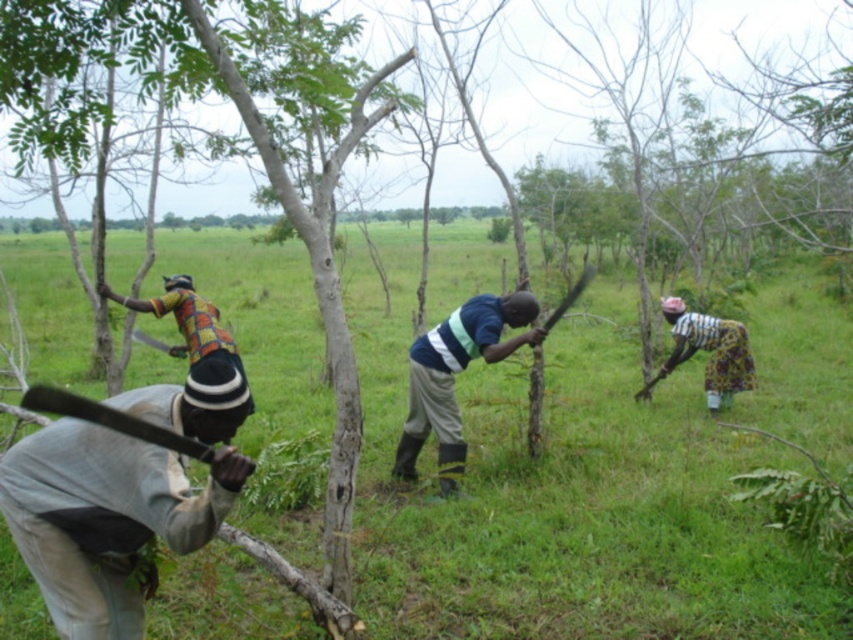
Looking at this image, does brown wooden stick at center have a greater width compared to multicolored fabric shirt at left?

Yes, brown wooden stick at center is wider than multicolored fabric shirt at left.

Is point (844, 632) positioned in front of point (148, 305)?

That is True.

Is point (572, 332) more distant than point (193, 337)?

Yes, it is behind point (193, 337).

Locate an element on the screen. The width and height of the screenshot is (853, 640). brown wooden stick at center is located at coordinates (572, 502).

Who is more distant from viewer, [158,492] or [51,403]?

Positioned behind is point [158,492].

Who is higher up, gray matte baseball bat at lower left or black matte ax at lower left?

black matte ax at lower left is above.

Is point (20, 460) more distant than point (83, 403)?

Yes.

Locate an element on the screen. The image size is (853, 640). gray matte baseball bat at lower left is located at coordinates (103, 518).

Does gray matte baseball bat at lower left have a smaller size compared to printed fabric skirt at right?

Indeed, gray matte baseball bat at lower left has a smaller size compared to printed fabric skirt at right.

Is gray matte baseball bat at lower left shorter than printed fabric skirt at right?

Yes, gray matte baseball bat at lower left is shorter than printed fabric skirt at right.

Find the location of a particular element. This screenshot has width=853, height=640. gray matte baseball bat at lower left is located at coordinates (103, 518).